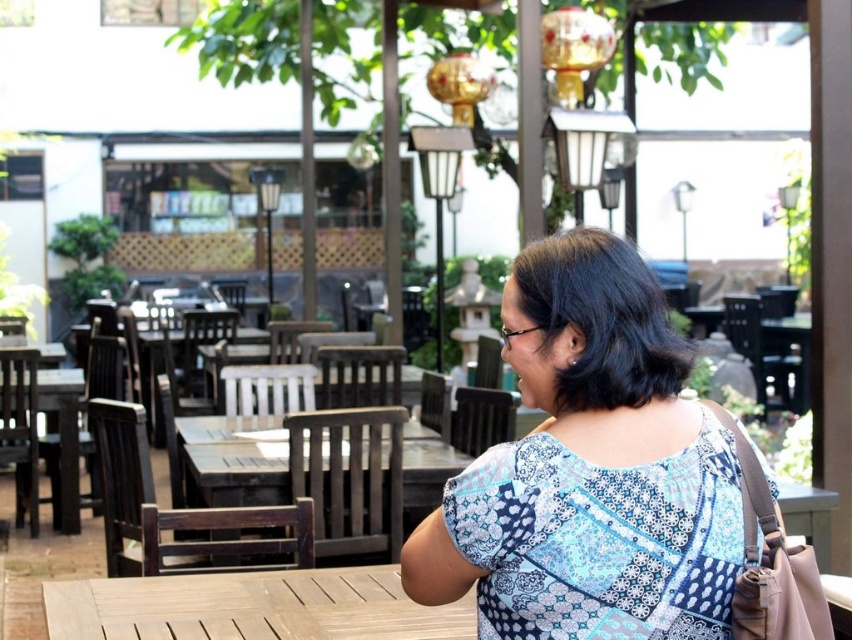
Question: Which point is closer to the camera taking this photo?

Choices:
 (A) (60, 428)
 (B) (364, 605)

Answer: (B)

Question: Does light brown wooden table at center appear on the left side of wooden table at left?

Choices:
 (A) yes
 (B) no

Answer: (B)

Question: Is light brown wooden table at center above wooden table at center?

Choices:
 (A) no
 (B) yes

Answer: (A)

Question: Is blue printed blouse at center further to camera compared to light brown wooden table at center?

Choices:
 (A) yes
 (B) no

Answer: (B)

Question: Among these objects, which one is nearest to the camera?

Choices:
 (A) wooden table at left
 (B) wooden table at center

Answer: (B)

Question: Estimate the real-world distances between objects in this image. Which object is closer to the blue printed blouse at center?

Choices:
 (A) wooden table at left
 (B) wooden table at center
 (C) light brown wooden table at center

Answer: (C)